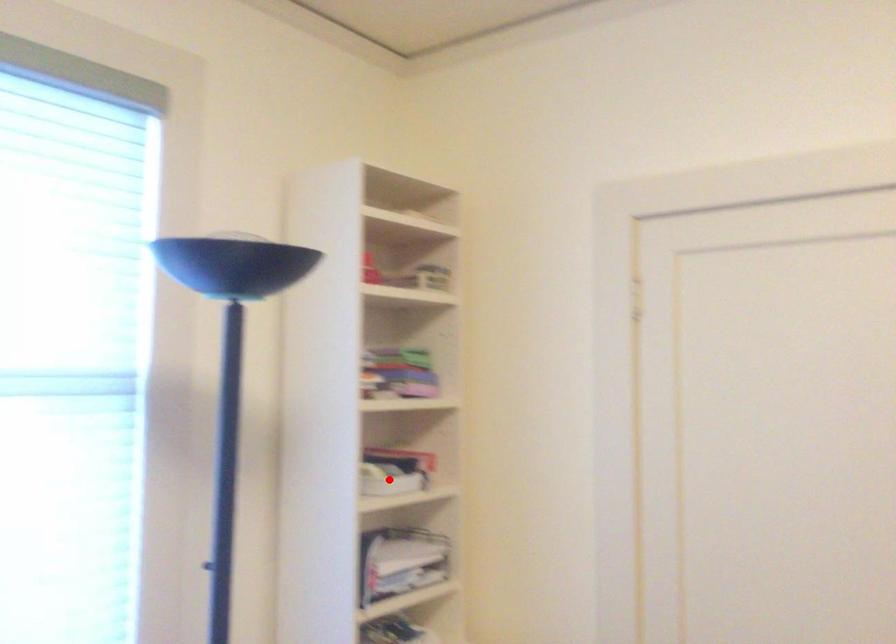
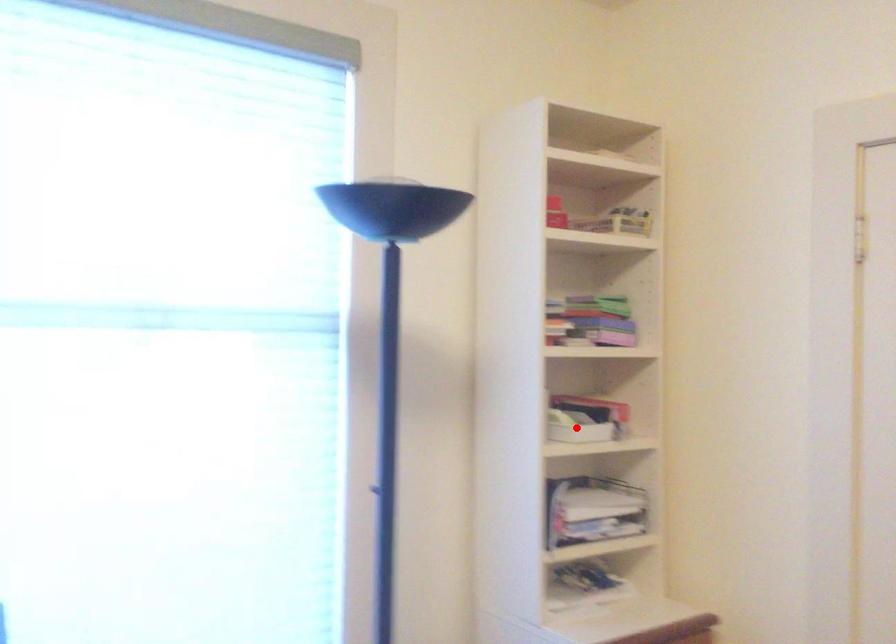
I am providing you with two images of the same scene from different viewpoints. A red point is marked on the first image and another point is marked on the second image. Do the highlighted points in image1 and image2 indicate the same real-world spot?

Yes